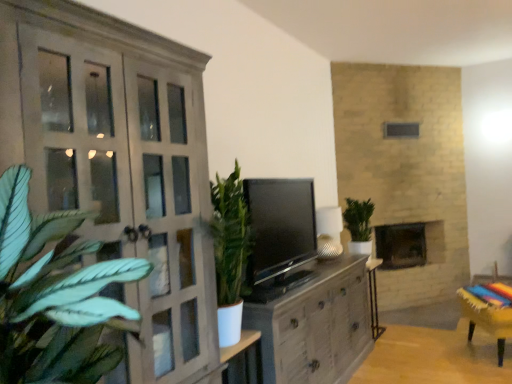
Question: From the image's perspective, is matte gray cupboard at left located above green leafy plant at center?

Choices:
 (A) no
 (B) yes

Answer: (B)

Question: Does matte gray cupboard at left contain green leafy plant at center?

Choices:
 (A) yes
 (B) no

Answer: (B)

Question: Is matte gray cupboard at left to the left of green leafy plant at center from the viewer's perspective?

Choices:
 (A) no
 (B) yes

Answer: (B)

Question: Does matte gray cupboard at left have a larger size compared to green leafy plant at center?

Choices:
 (A) yes
 (B) no

Answer: (A)

Question: Does matte gray cupboard at left have a lesser height compared to green leafy plant at center?

Choices:
 (A) no
 (B) yes

Answer: (A)

Question: Considering the relative positions of matte gray cupboard at left and green leafy plant at center in the image provided, is matte gray cupboard at left to the right of green leafy plant at center from the viewer's perspective?

Choices:
 (A) no
 (B) yes

Answer: (A)

Question: Considering the relative sizes of dark gray stone fireplace at center and matte gray cupboard at left in the image provided, is dark gray stone fireplace at center taller than matte gray cupboard at left?

Choices:
 (A) yes
 (B) no

Answer: (B)

Question: Does dark gray stone fireplace at center have a smaller size compared to matte gray cupboard at left?

Choices:
 (A) yes
 (B) no

Answer: (A)

Question: Does dark gray stone fireplace at center have a larger size compared to matte gray cupboard at left?

Choices:
 (A) yes
 (B) no

Answer: (B)

Question: Is dark gray stone fireplace at center outside matte gray cupboard at left?

Choices:
 (A) no
 (B) yes

Answer: (B)

Question: Is dark gray stone fireplace at center to the left of matte gray cupboard at left from the viewer's perspective?

Choices:
 (A) no
 (B) yes

Answer: (A)

Question: Is dark gray stone fireplace at center oriented towards matte gray cupboard at left?

Choices:
 (A) no
 (B) yes

Answer: (A)

Question: Can you confirm if dark gray stone fireplace at center is shorter than wooden table at lower right, the 1th table in the right-to-left sequence?

Choices:
 (A) yes
 (B) no

Answer: (B)